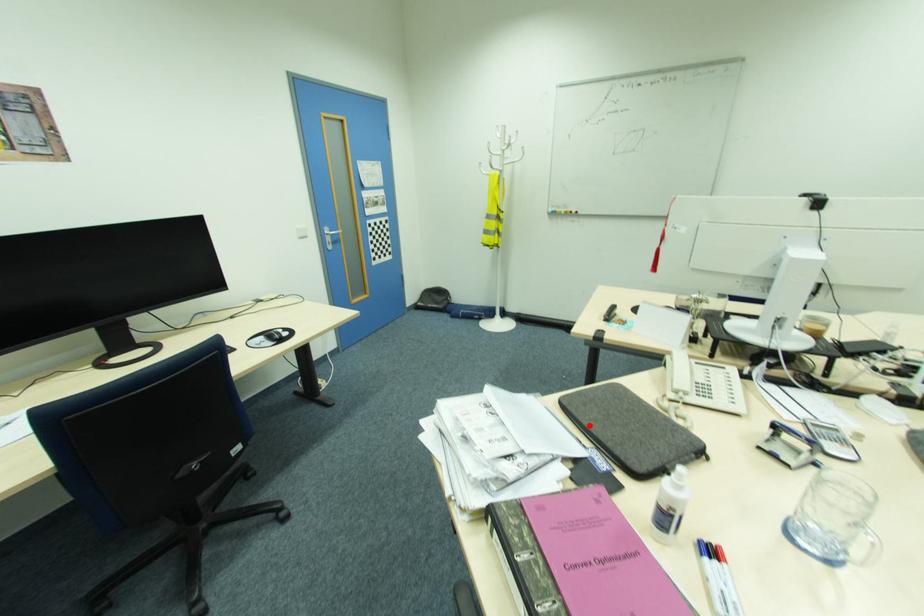
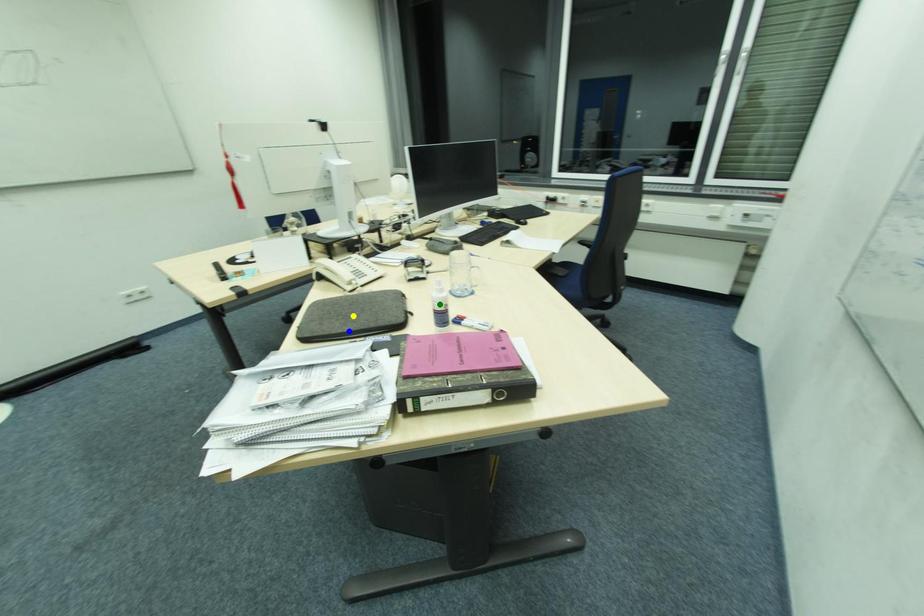
Question: I am providing you with two images of the same scene from different viewpoints. A red point is marked on the first image. You are given multiple points on the second image. Which point in image 2 represents the same 3d spot as the red point in image 1?

Choices:
 (A) green point
 (B) yellow point
 (C) blue point

Answer: (C)